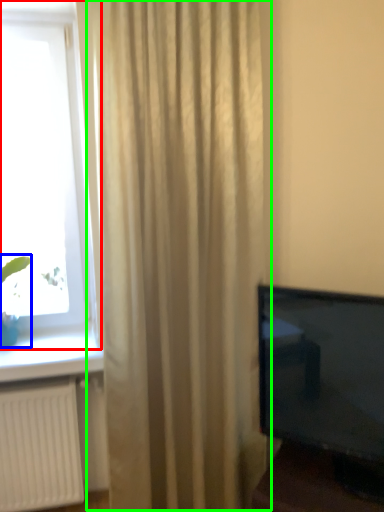
Question: Which object is the closest to the window (highlighted by a red box)? Choose among these: plant (highlighted by a blue box) or curtain (highlighted by a green box).

Choices:
 (A) plant
 (B) curtain

Answer: (B)